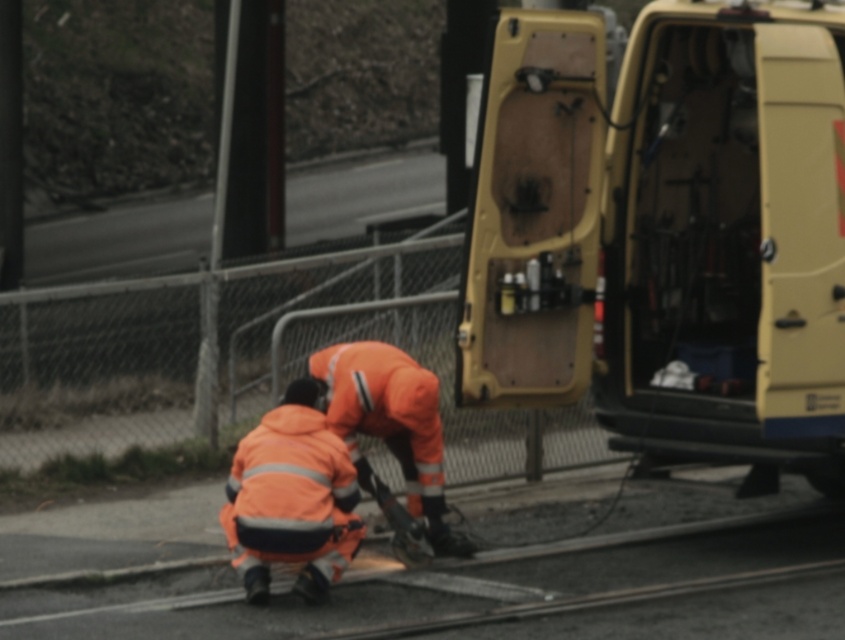
Does beige matte van door at center have a greater width compared to orange reflective jacket at lower center?

Indeed, beige matte van door at center has a greater width compared to orange reflective jacket at lower center.

Which is behind, point (728, 348) or point (277, 472)?

Point (728, 348)

Identify the location of beige matte van door at center. (666, 234).

Does orange reflective jacket at lower center have a greater width compared to orange reflective jumpsuit at center?

No, orange reflective jacket at lower center is not wider than orange reflective jumpsuit at center.

Can you confirm if orange reflective jacket at lower center is smaller than orange reflective jumpsuit at center?

Correct, orange reflective jacket at lower center occupies less space than orange reflective jumpsuit at center.

Which is in front, point (255, 582) or point (428, 522)?

Point (255, 582) is in front.

Where is `orange reflective jacket at lower center`? The image size is (845, 640). orange reflective jacket at lower center is located at coordinates (292, 499).

How far apart are beige matte van door at center and orange reflective jumpsuit at center?

beige matte van door at center and orange reflective jumpsuit at center are 1.13 meters apart from each other.

Identify the location of beige matte van door at center. This screenshot has width=845, height=640. coord(666,234).

Is point (691, 378) less distant than point (379, 340)?

No, (691, 378) is further to viewer.

You are a GUI agent. You are given a task and a screenshot of the screen. Output one action in this format:
    pyautogui.click(x=<x>, y=<y>)
    Task: Click on the beige matte van door at center
    
    Given the screenshot: What is the action you would take?
    pyautogui.click(x=666, y=234)